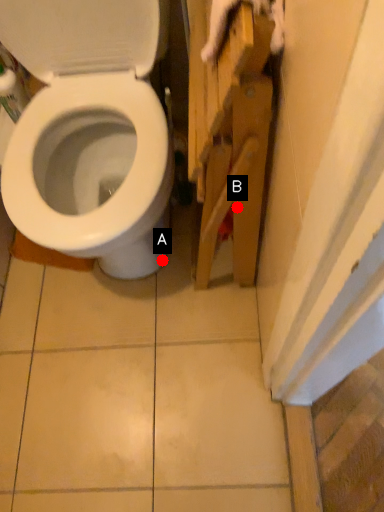
Question: Two points are circled on the image, labeled by A and B beside each circle. Which point is closer to the camera?

Choices:
 (A) A is closer
 (B) B is closer

Answer: (B)